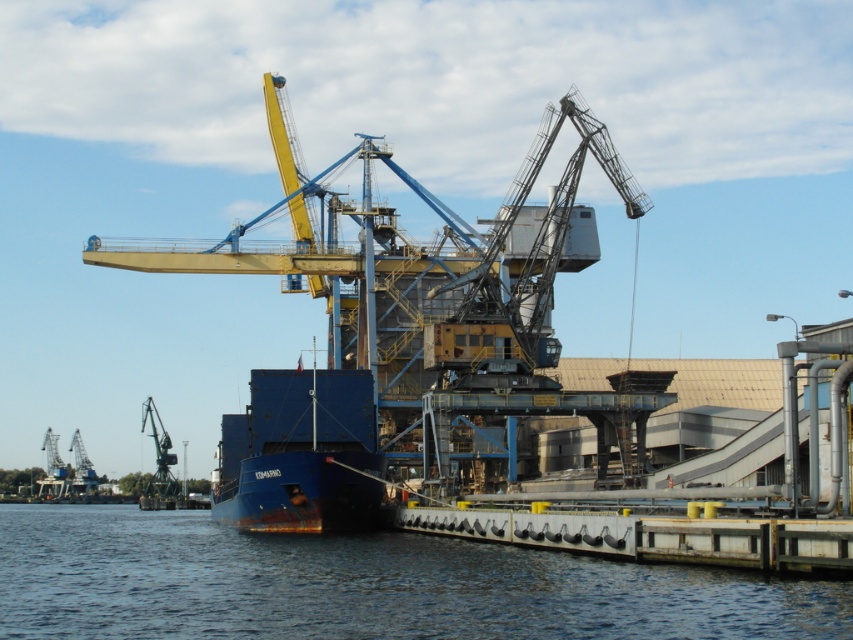
Is blue water at lower left to the right of blue matte container ship at center from the viewer's perspective?

In fact, blue water at lower left is to the left of blue matte container ship at center.

Is point (202, 566) closer to viewer compared to point (299, 404)?

Yes, point (202, 566) is in front of point (299, 404).

This screenshot has height=640, width=853. Find the location of `blue water at lower left`. blue water at lower left is located at coordinates (364, 586).

Between point (544, 394) and point (467, 627), which one is positioned behind?

The point (544, 394) is behind.

Which is in front, point (485, 381) or point (587, 627)?

Positioned in front is point (587, 627).

Locate an element on the screen. Image resolution: width=853 pixels, height=640 pixels. yellow metallic crane at center is located at coordinates (437, 300).

Can you confirm if yellow metallic crane at center is bigger than blue matte container ship at center?

Indeed, yellow metallic crane at center has a larger size compared to blue matte container ship at center.

Is yellow metallic crane at center smaller than blue matte container ship at center?

Incorrect, yellow metallic crane at center is not smaller in size than blue matte container ship at center.

Which is in front, point (392, 170) or point (294, 500)?

Point (294, 500)

At what (x,y) coordinates should I click in order to perform the action: click on yellow metallic crane at center. Please return your answer as a coordinate pair (x, y). Image resolution: width=853 pixels, height=640 pixels. Looking at the image, I should click on (437, 300).